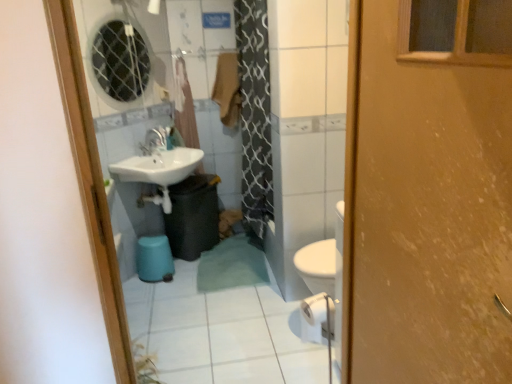
Where is `free point below matte white faucet at center (from a real-world perspective)`? free point below matte white faucet at center (from a real-world perspective) is located at coordinates (153, 157).